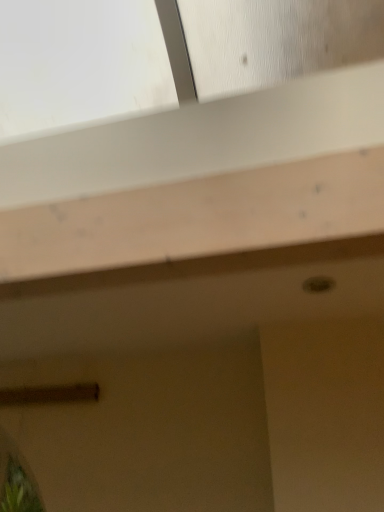
Measure the distance between brown matte wood at lower left and camera.

The distance of brown matte wood at lower left from camera is 1.50 meters.

Describe the element at coordinates (49, 394) in the screenshot. The height and width of the screenshot is (512, 384). I see `brown matte wood at lower left` at that location.

The image size is (384, 512). I want to click on brown matte wood at lower left, so tap(49, 394).

This screenshot has width=384, height=512. Identify the location of brown matte wood at lower left. (49, 394).